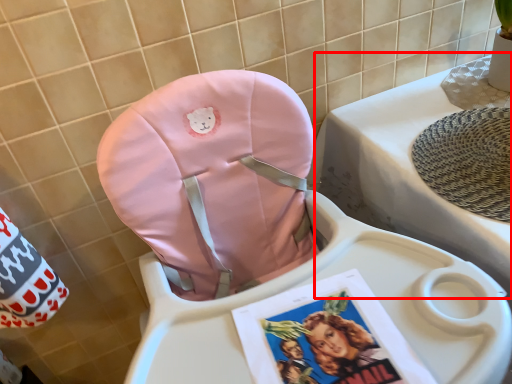
Question: In this image, where is changing table (annotated by the red box) located relative to baby carriage?

Choices:
 (A) right
 (B) left

Answer: (A)